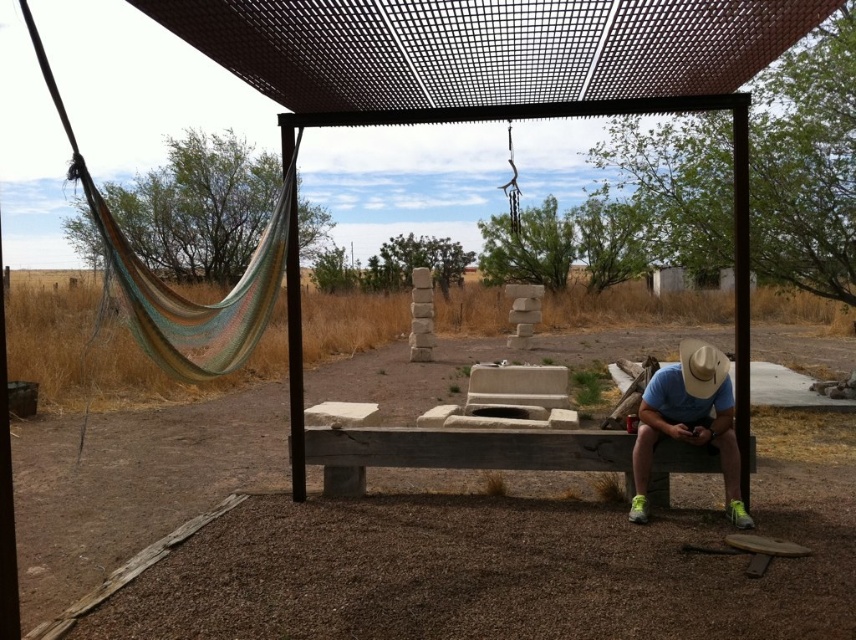
Measure the distance from blue cotton shirt at lower right to white felt cowboy hat at right.

They are 12.15 inches apart.

Who is more distant from viewer, (724, 380) or (694, 364)?

Point (724, 380)

This screenshot has height=640, width=856. I want to click on blue cotton shirt at lower right, so click(x=688, y=420).